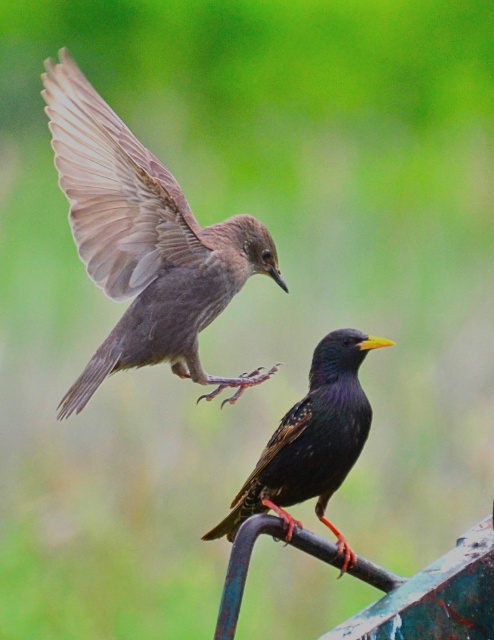
Question: Can you confirm if brown feathered bird at upper left is positioned to the left of shiny black bird at center?

Choices:
 (A) no
 (B) yes

Answer: (B)

Question: Among these points, which one is farthest from the camera?

Choices:
 (A) (249, 275)
 (B) (355, 436)

Answer: (A)

Question: Does brown feathered wing at upper left have a larger size compared to shiny black bird at center?

Choices:
 (A) yes
 (B) no

Answer: (A)

Question: Can you confirm if brown feathered bird at upper left is bigger than shiny black bird at center?

Choices:
 (A) yes
 (B) no

Answer: (A)

Question: Which is nearer to the brown feathered wing at upper left?

Choices:
 (A) shiny black bird at center
 (B) brown feathered bird at upper left

Answer: (B)

Question: Which point is farther from the camera taking this photo?

Choices:
 (A) (70, 108)
 (B) (158, 308)

Answer: (B)